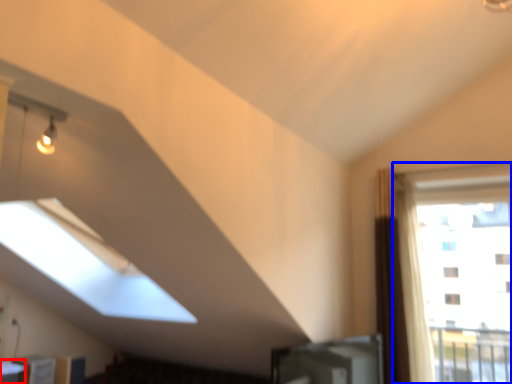
Question: Which of the following is the farthest to the observer, table (highlighted by a red box) or window (highlighted by a blue box)?

Choices:
 (A) table
 (B) window

Answer: (B)